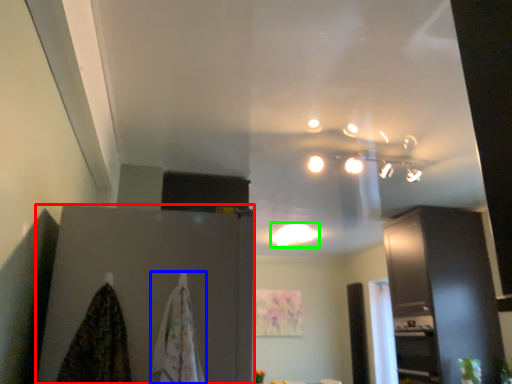
Question: Based on their relative distances, which object is nearer to cabinetry (highlighted by a red box)? Choose from blanket (highlighted by a blue box) and lighting (highlighted by a green box).

Choices:
 (A) blanket
 (B) lighting

Answer: (A)